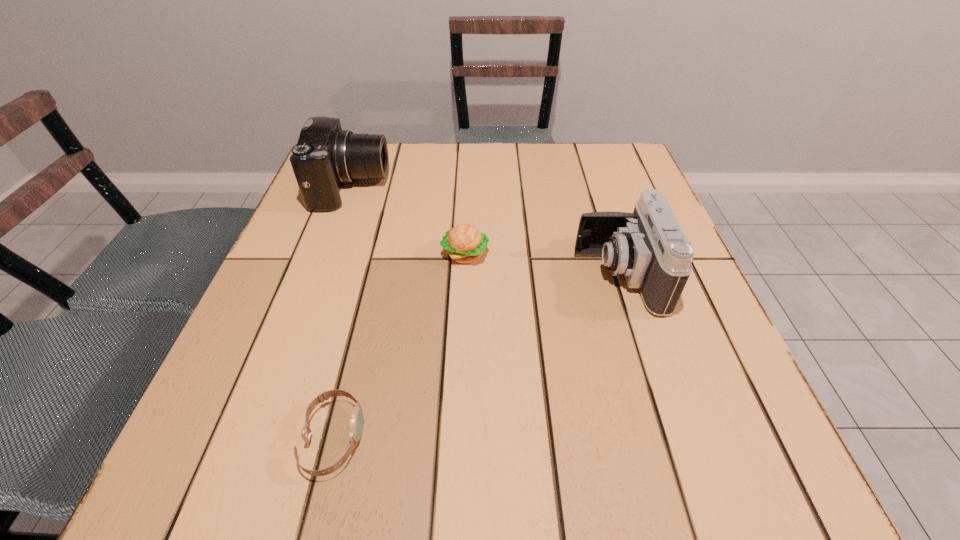
The width and height of the screenshot is (960, 540). What are the coordinates of `the left camera` in the screenshot? It's located at (325, 157).

Image resolution: width=960 pixels, height=540 pixels. Find the location of `the farthest object`. the farthest object is located at coordinates (325, 157).

Find the location of a particular element. The image size is (960, 540). the right camera is located at coordinates (648, 246).

Locate an element on the screen. This screenshot has height=540, width=960. the rightmost object is located at coordinates (648, 246).

At what (x,y) coordinates should I click in order to perform the action: click on hamburger. Please return your answer as a coordinate pair (x, y). The height and width of the screenshot is (540, 960). Looking at the image, I should click on (465, 244).

Locate an element on the screen. The height and width of the screenshot is (540, 960). the second shortest object is located at coordinates (465, 244).

Identify the location of watch. (356, 418).

You are a GUI agent. You are given a task and a screenshot of the screen. Output one action in this format:
    pyautogui.click(x=<x>, y=<y>)
    Task: Click on the shortest object
    This screenshot has width=960, height=540.
    Given the screenshot: What is the action you would take?
    pyautogui.click(x=356, y=418)

The width and height of the screenshot is (960, 540). I want to click on free space located on the lens of the left camera, so click(x=499, y=187).

Find the location of a particular element. The height and width of the screenshot is (540, 960). free space located 0.120m at the front of the right camera with an open lens cover is located at coordinates (516, 276).